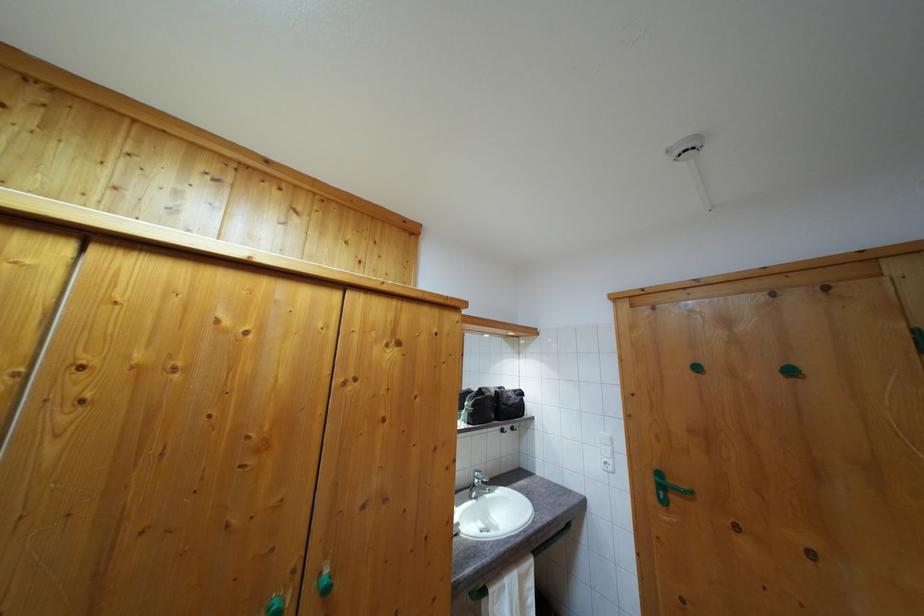
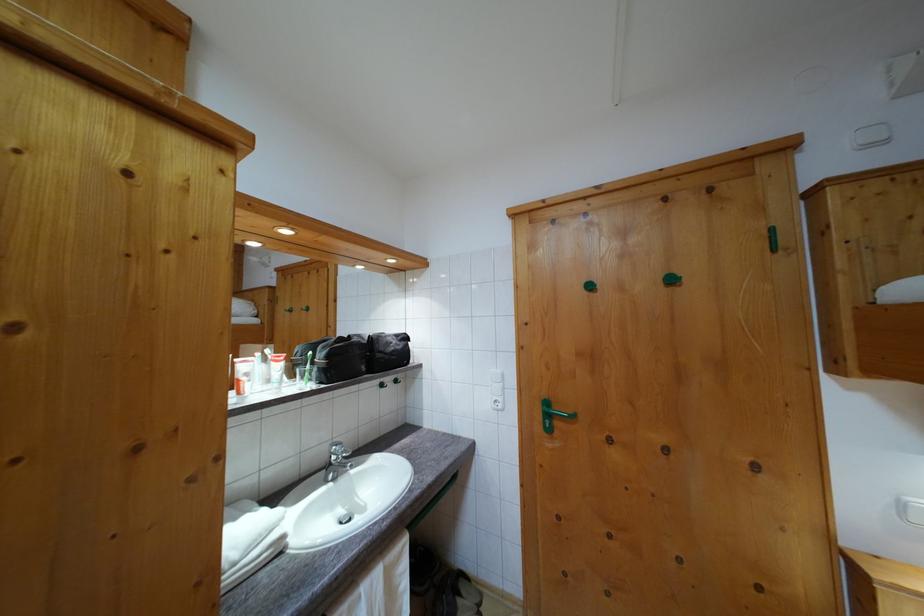
Locate, in the second image, the point that corresponds to (x=664, y=493) in the first image.

(552, 422)